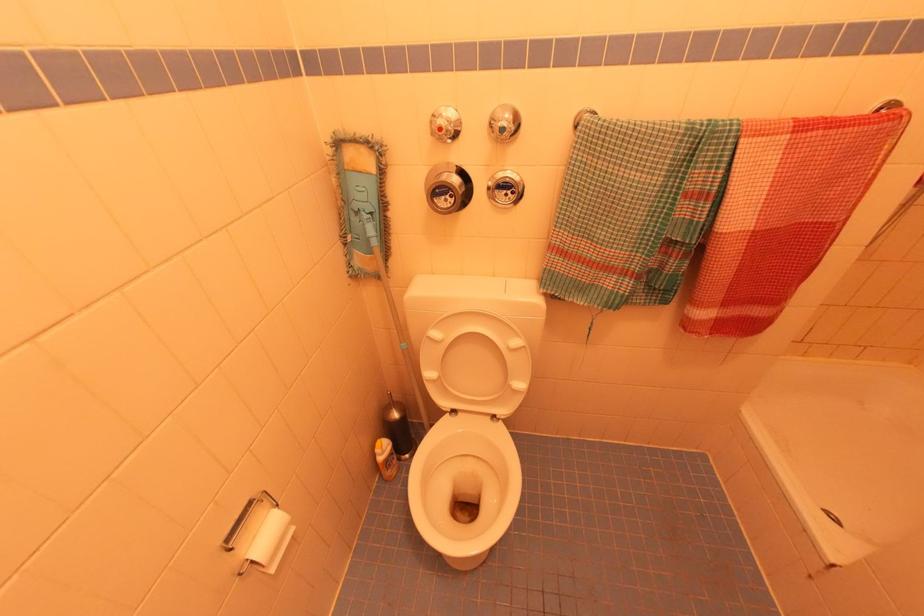
Where would you lower the white toilet lid? Please return your answer as a coordinate pair (x, y).

(475, 363)